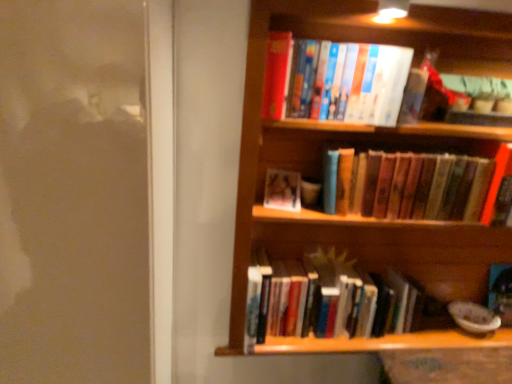
I want to click on matte plastic photo frame at center, the third book viewed from the top, so click(x=282, y=190).

Find the location of a particular element. This screenshot has width=512, height=384. hardcover books at upper center, the 4th book ordered from the bottom is located at coordinates (332, 80).

Where is `hardcover books at lower center, the 4th book positioned from the top`? The height and width of the screenshot is (384, 512). hardcover books at lower center, the 4th book positioned from the top is located at coordinates (328, 299).

Locate an element on the screen. The width and height of the screenshot is (512, 384). hardcover books at center, which is counted as the third book, starting from the bottom is located at coordinates (425, 184).

The image size is (512, 384). What are the coordinates of `matte plastic photo frame at center, acting as the second book starting from the bottom` in the screenshot? It's located at (282, 190).

Considering the sizes of objects hardcover books at lower center, the 4th book positioned from the top, and wooden bookshelf at upper right in the image provided, who is bigger, hardcover books at lower center, the 4th book positioned from the top, or wooden bookshelf at upper right?

With larger size is wooden bookshelf at upper right.

Is hardcover books at lower center, positioned as the 1th book in bottom-to-top order, inside or outside of wooden bookshelf at upper right?

hardcover books at lower center, positioned as the 1th book in bottom-to-top order, fits inside wooden bookshelf at upper right.

Is hardcover books at lower center, the 4th book positioned from the top, wider than wooden bookshelf at upper right?

No, hardcover books at lower center, the 4th book positioned from the top, is not wider than wooden bookshelf at upper right.

Is hardcover books at lower center, the 4th book positioned from the top, closer to the viewer compared to wooden bookshelf at upper right?

No, it is behind wooden bookshelf at upper right.

From a real-world perspective, who is located higher, matte plastic photo frame at center, acting as the second book starting from the bottom, or hardcover books at lower center, the 4th book positioned from the top?

From a 3D spatial view, matte plastic photo frame at center, acting as the second book starting from the bottom, is above.

Is matte plastic photo frame at center, the third book viewed from the top, to the left or to the right of hardcover books at lower center, the 4th book positioned from the top, in the image?

matte plastic photo frame at center, the third book viewed from the top, is positioned on hardcover books at lower center, the 4th book positioned from the top,'s left side.

Identify the location of the 1st book positioned above the hardcover books at lower center, positioned as the 1th book in bottom-to-top order (from the image's perspective). The width and height of the screenshot is (512, 384). (282, 190).

Can hardcover books at lower center, positioned as the 1th book in bottom-to-top order, be found inside matte plastic photo frame at center, acting as the second book starting from the bottom?

No, matte plastic photo frame at center, acting as the second book starting from the bottom, does not contain hardcover books at lower center, positioned as the 1th book in bottom-to-top order.

From a real-world perspective, is matte plastic photo frame at center, the third book viewed from the top, physically located above or below wooden bookshelf at upper right?

Clearly, from a real-world perspective, matte plastic photo frame at center, the third book viewed from the top, is above wooden bookshelf at upper right.

From the image's perspective, would you say matte plastic photo frame at center, the third book viewed from the top, is shown under wooden bookshelf at upper right?

Actually, matte plastic photo frame at center, the third book viewed from the top, appears above wooden bookshelf at upper right in the image.

Looking at their sizes, would you say matte plastic photo frame at center, the third book viewed from the top, is wider or thinner than wooden bookshelf at upper right?

In the image, matte plastic photo frame at center, the third book viewed from the top, appears to be more narrow than wooden bookshelf at upper right.

Is matte plastic photo frame at center, the third book viewed from the top, not near wooden bookshelf at upper right?

matte plastic photo frame at center, the third book viewed from the top, is near wooden bookshelf at upper right, not far away.

Is wooden bookshelf at upper right not close to hardcover books at upper center, the 4th book ordered from the bottom?

wooden bookshelf at upper right is near hardcover books at upper center, the 4th book ordered from the bottom, not far away.

Considering the sizes of wooden bookshelf at upper right and hardcover books at upper center, the 4th book ordered from the bottom, in the image, is wooden bookshelf at upper right taller or shorter than hardcover books at upper center, the 4th book ordered from the bottom,?

wooden bookshelf at upper right is taller than hardcover books at upper center, the 4th book ordered from the bottom.

Can you confirm if wooden bookshelf at upper right is bigger than hardcover books at upper center, which is counted as the 1th book, starting from the top?

Indeed, wooden bookshelf at upper right has a larger size compared to hardcover books at upper center, which is counted as the 1th book, starting from the top.

From the image's perspective, is hardcover books at upper center, which is counted as the 1th book, starting from the top, located above or below hardcover books at lower center, the 4th book positioned from the top?

From the image's perspective, hardcover books at upper center, which is counted as the 1th book, starting from the top, appears above hardcover books at lower center, the 4th book positioned from the top.

Between hardcover books at upper center, the 4th book ordered from the bottom, and hardcover books at lower center, positioned as the 1th book in bottom-to-top order, which one has smaller size?

hardcover books at upper center, the 4th book ordered from the bottom, is smaller.

Which of these two, hardcover books at upper center, which is counted as the 1th book, starting from the top, or hardcover books at lower center, the 4th book positioned from the top, is wider?

Wider between the two is hardcover books at upper center, which is counted as the 1th book, starting from the top.

Consider the image. Which is correct: hardcover books at lower center, positioned as the 1th book in bottom-to-top order, is inside hardcover books at center, acting as the second book starting from the top, or outside of it?

hardcover books at lower center, positioned as the 1th book in bottom-to-top order, is outside hardcover books at center, acting as the second book starting from the top.

Can you tell me how much hardcover books at lower center, the 4th book positioned from the top, and hardcover books at center, which is counted as the third book, starting from the bottom, differ in facing direction?

They differ by 0.000135 degrees in their facing directions.

Between hardcover books at lower center, positioned as the 1th book in bottom-to-top order, and hardcover books at center, acting as the second book starting from the top, which one is positioned in front?

Positioned in front is hardcover books at center, acting as the second book starting from the top.

Measure the distance from matte plastic photo frame at center, the third book viewed from the top, to hardcover books at center, which is counted as the third book, starting from the bottom.

13.21 inches.

Which point is more distant from viewer, (268, 180) or (451, 211)?

The point (268, 180) is behind.

Is matte plastic photo frame at center, acting as the second book starting from the bottom, in front of or behind hardcover books at center, acting as the second book starting from the top, in the image?

matte plastic photo frame at center, acting as the second book starting from the bottom, is behind hardcover books at center, acting as the second book starting from the top.

Considering the relative positions of matte plastic photo frame at center, the third book viewed from the top, and hardcover books at center, acting as the second book starting from the top, in the image provided, is matte plastic photo frame at center, the third book viewed from the top, to the right of hardcover books at center, acting as the second book starting from the top, from the viewer's perspective?

Incorrect, matte plastic photo frame at center, the third book viewed from the top, is not on the right side of hardcover books at center, acting as the second book starting from the top.

Where is `shelf above the hardcover books at lower center, the 4th book positioned from the top (from a real-world perspective)`? shelf above the hardcover books at lower center, the 4th book positioned from the top (from a real-world perspective) is located at coordinates (362, 143).

You are a GUI agent. You are given a task and a screenshot of the screen. Output one action in this format:
    pyautogui.click(x=<x>, y=<y>)
    Task: Click on the book that is under the matte plastic photo frame at center, the third book viewed from the top (from a real-world perspective)
    This screenshot has width=512, height=384.
    Given the screenshot: What is the action you would take?
    pyautogui.click(x=328, y=299)

Based on their spatial positions, is hardcover books at center, acting as the second book starting from the top, or matte plastic photo frame at center, acting as the second book starting from the bottom, closer to hardcover books at upper center, which is counted as the 1th book, starting from the top?

hardcover books at center, acting as the second book starting from the top, is positioned closer to the anchor hardcover books at upper center, which is counted as the 1th book, starting from the top.

Which object lies nearer to the anchor point hardcover books at upper center, the 4th book ordered from the bottom, wooden bookshelf at upper right or hardcover books at center, acting as the second book starting from the top?

Based on the image, wooden bookshelf at upper right appears to be nearer to hardcover books at upper center, the 4th book ordered from the bottom.

Looking at the image, which one is located closer to hardcover books at upper center, which is counted as the 1th book, starting from the top, hardcover books at lower center, the 4th book positioned from the top, or matte plastic photo frame at center, the third book viewed from the top?

matte plastic photo frame at center, the third book viewed from the top, lies closer to hardcover books at upper center, which is counted as the 1th book, starting from the top, than the other object.

Looking at the image, which one is located closer to hardcover books at center, acting as the second book starting from the top, wooden bookshelf at upper right or hardcover books at upper center, which is counted as the 1th book, starting from the top?

Among the two, wooden bookshelf at upper right is located nearer to hardcover books at center, acting as the second book starting from the top.

From the image, which object appears to be nearer to wooden bookshelf at upper right, hardcover books at lower center, the 4th book positioned from the top, or hardcover books at center, which is counted as the third book, starting from the bottom?

hardcover books at center, which is counted as the third book, starting from the bottom.

Which object lies nearer to the anchor point wooden bookshelf at upper right, hardcover books at center, acting as the second book starting from the top, or hardcover books at lower center, positioned as the 1th book in bottom-to-top order?

Based on the image, hardcover books at center, acting as the second book starting from the top, appears to be nearer to wooden bookshelf at upper right.

From the image, which object appears to be nearer to matte plastic photo frame at center, acting as the second book starting from the bottom, wooden bookshelf at upper right or hardcover books at center, acting as the second book starting from the top?

wooden bookshelf at upper right is positioned closer to the anchor matte plastic photo frame at center, acting as the second book starting from the bottom.

From the image, which object appears to be farther from wooden bookshelf at upper right, matte plastic photo frame at center, acting as the second book starting from the bottom, or hardcover books at center, acting as the second book starting from the top?

The object further to wooden bookshelf at upper right is matte plastic photo frame at center, acting as the second book starting from the bottom.

This screenshot has height=384, width=512. I want to click on book between hardcover books at center, acting as the second book starting from the top, and hardcover books at lower center, positioned as the 1th book in bottom-to-top order, from top to bottom, so click(x=282, y=190).

I want to click on shelf between matte plastic photo frame at center, the third book viewed from the top, and hardcover books at lower center, positioned as the 1th book in bottom-to-top order, from top to bottom, so pos(362,143).

What are the coordinates of `shelf between hardcover books at upper center, the 4th book ordered from the bottom, and hardcover books at lower center, positioned as the 1th book in bottom-to-top order, from top to bottom` in the screenshot? It's located at (362, 143).

Locate an element on the screen. This screenshot has width=512, height=384. shelf that lies between hardcover books at center, acting as the second book starting from the top, and hardcover books at lower center, the 4th book positioned from the top, from top to bottom is located at coordinates (362, 143).